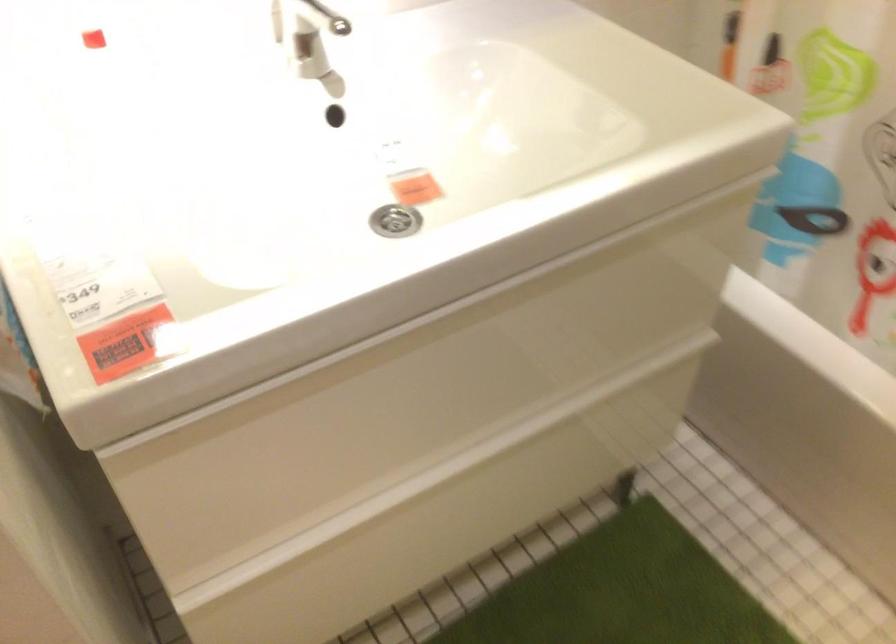
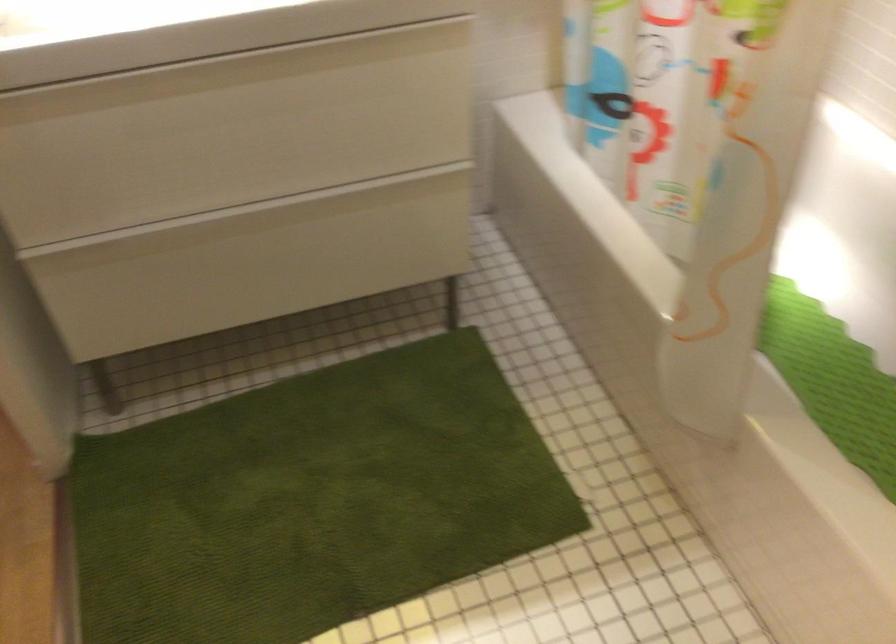
The point at (494, 292) is marked in the first image. Where is the corresponding point in the second image?

(228, 70)